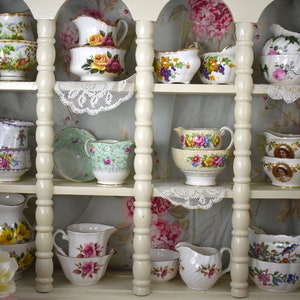
Where is `cups on top shelf`? The width and height of the screenshot is (300, 300). cups on top shelf is located at coordinates (23, 27), (23, 47), (94, 72), (101, 34), (179, 81), (216, 68), (274, 65), (275, 53).